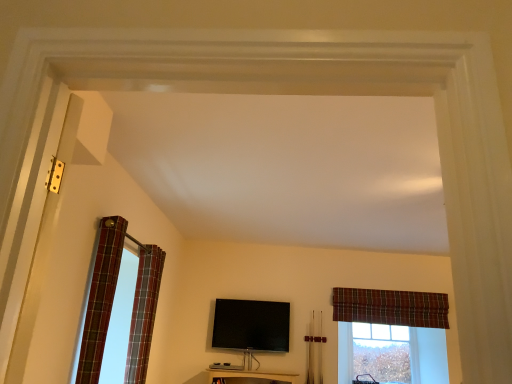
Question: From a real-world perspective, does plaid fabric curtain at left, which is the 2th curtain from right to left, stand above clear glass window at center?

Choices:
 (A) yes
 (B) no

Answer: (A)

Question: Can you confirm if plaid fabric curtain at left, the second curtain positioned from the left, is positioned to the right of clear glass window at center?

Choices:
 (A) yes
 (B) no

Answer: (B)

Question: Is plaid fabric curtain at left, which is the 2th curtain in back-to-front order, aimed at clear glass window at center?

Choices:
 (A) no
 (B) yes

Answer: (A)

Question: Is plaid fabric curtain at left, which is the 2th curtain in back-to-front order, positioned beyond the bounds of clear glass window at center?

Choices:
 (A) no
 (B) yes

Answer: (B)

Question: Is plaid fabric curtain at left, the 2th curtain from the front, thinner than clear glass window at center?

Choices:
 (A) yes
 (B) no

Answer: (B)

Question: Is plaid fabric curtain at left, the 2th curtain from the front, next to clear glass window at center and touching it?

Choices:
 (A) no
 (B) yes

Answer: (A)

Question: Does black glossy flat-screen tv at center have a lesser height compared to plaid fabric curtain at left, arranged as the 3th curtain when viewed from the back?

Choices:
 (A) no
 (B) yes

Answer: (B)

Question: Is black glossy flat-screen tv at center oriented away from plaid fabric curtain at left, the 3th curtain from the right?

Choices:
 (A) no
 (B) yes

Answer: (A)

Question: Is black glossy flat-screen tv at center facing towards plaid fabric curtain at left, acting as the 1th curtain starting from the left?

Choices:
 (A) no
 (B) yes

Answer: (B)

Question: From a real-world perspective, is black glossy flat-screen tv at center beneath plaid fabric curtain at left, acting as the 1th curtain starting from the left?

Choices:
 (A) no
 (B) yes

Answer: (B)

Question: Considering the relative sizes of black glossy flat-screen tv at center and plaid fabric curtain at left, which is the 1th curtain in front-to-back order, in the image provided, is black glossy flat-screen tv at center thinner than plaid fabric curtain at left, which is the 1th curtain in front-to-back order,?

Choices:
 (A) yes
 (B) no

Answer: (A)

Question: Does black glossy flat-screen tv at center contain plaid fabric curtain at left, acting as the 1th curtain starting from the left?

Choices:
 (A) no
 (B) yes

Answer: (A)

Question: From the image's perspective, is plaid fabric curtain at upper right, which is the 3th curtain from left to right, on top of plaid fabric curtain at left, arranged as the 3th curtain when viewed from the back?

Choices:
 (A) yes
 (B) no

Answer: (B)